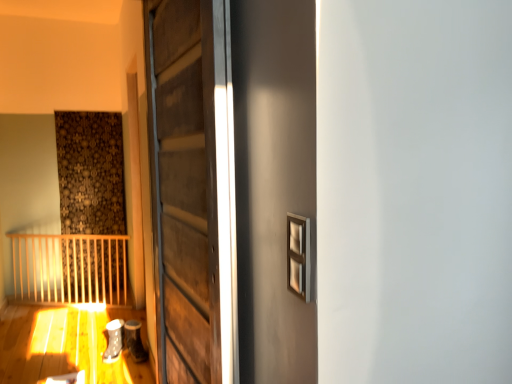
Where is `free space between matte gray shoe at lower left, the 2th shoe in the left-to-right sequence, and white matte shoe at lower left, the 2th shoe positioned from the right`? The image size is (512, 384). free space between matte gray shoe at lower left, the 2th shoe in the left-to-right sequence, and white matte shoe at lower left, the 2th shoe positioned from the right is located at coordinates 122,359.